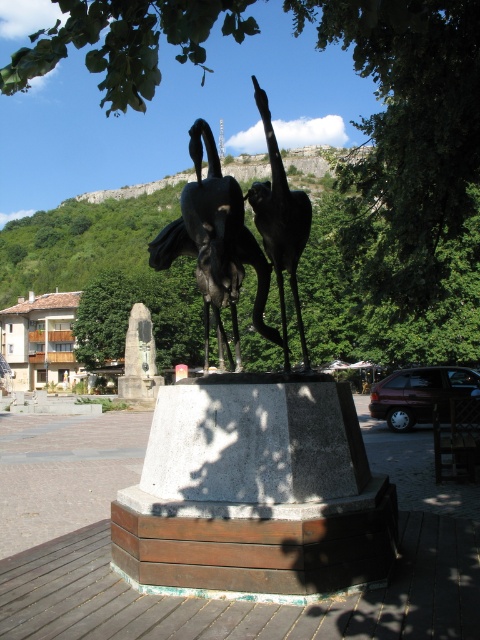
Question: From the image, what is the correct spatial relationship of green leafy tree at upper center in relation to shiny bronze bird at center?

Choices:
 (A) left
 (B) right

Answer: (A)

Question: In this image, where is bronze sculpture at center located relative to shiny bronze bird at center?

Choices:
 (A) right
 (B) left

Answer: (A)

Question: Which of the following is the closest to the observer?

Choices:
 (A) (450, 200)
 (B) (132, 356)
 (C) (285, 545)
 (D) (298, 248)

Answer: (C)

Question: Which point appears closest to the camera in this image?

Choices:
 (A) tap(374, 38)
 (B) tap(149, 346)

Answer: (A)

Question: Which of the following is the farthest from the observer?

Choices:
 (A) shiny bronze bird at center
 (B) bronze plaque at center
 (C) green leafy tree at upper center

Answer: (B)

Question: Does bronze sculpture at center have a greater width compared to polished bronze birds at center?

Choices:
 (A) yes
 (B) no

Answer: (A)